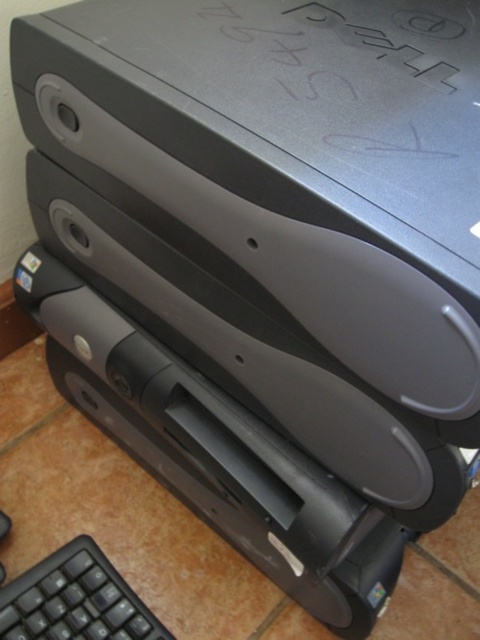
You are organizing a tech event and need to set up a demo station. You have a Dell desktop computer with a black matte text at upper center and a black matte keyboard at lower left. Which object should you check first if you want to ensure the keyboard fits properly on the desk space?

The black matte text at upper center is bigger than the black matte keyboard at lower left, so you should check the size of the black matte keyboard at lower left first to ensure it fits properly on the desk space.

You are a technician who needs to read the black matte text at upper center on a Dell desktop computer stack. The text contains important serial numbers. Given that your eyes are 20 inches away from the stack, can you comfortably read the text without moving closer?

The black matte text at upper center is 18.81 inches from the viewer. Since your eyes are 20 inches away from the stack, you are slightly farther than the text distance, so you might have difficulty reading it clearly without moving closer.